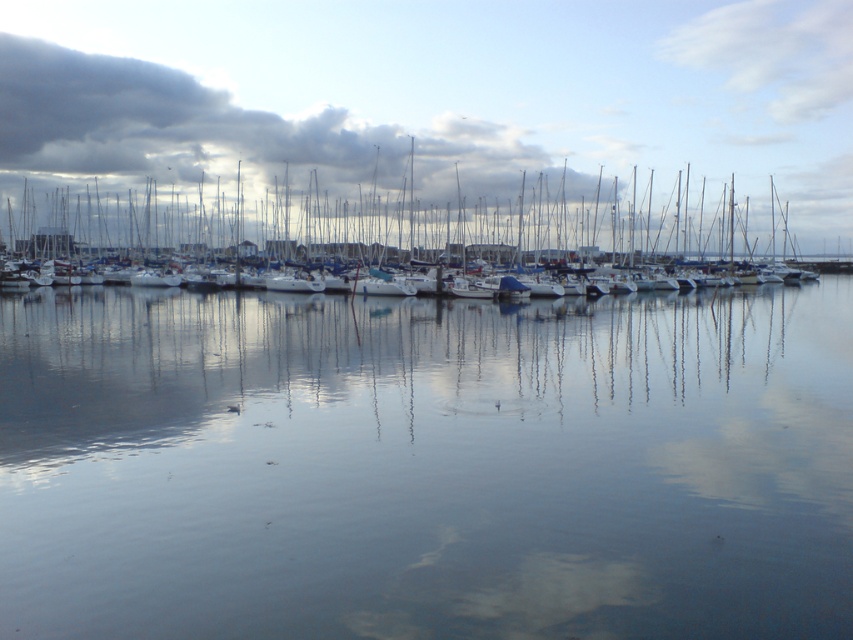
You are a photographer planning to capture the marina scene. You want to ensure that the transparent water at center and the dark gray cloud at upper left are both visible in your shot. Based on their positions, which object will appear closer to the bottom of the photo?

The transparent water at center appears closer to the bottom of the photo because it is shorter than the dark gray cloud at upper left.

From the picture: You are standing at the edge of the marina looking out. Which object, the transparent water at center or the dark gray cloud at upper left, would appear larger to you based on their positions?

The transparent water at center appears larger because it is closer to the viewer than the dark gray cloud at upper left.